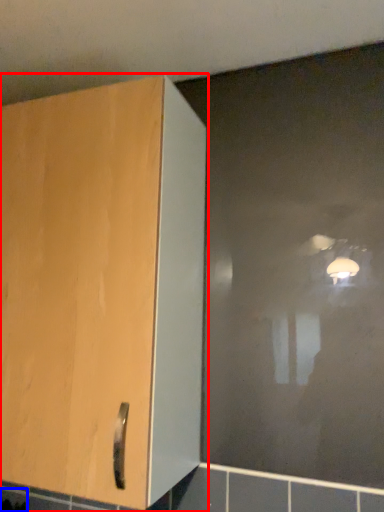
Question: Which object appears closest to the camera in this image, cupboard (highlighted by a red box) or ceramic tile (highlighted by a blue box)?

Choices:
 (A) cupboard
 (B) ceramic tile

Answer: (A)